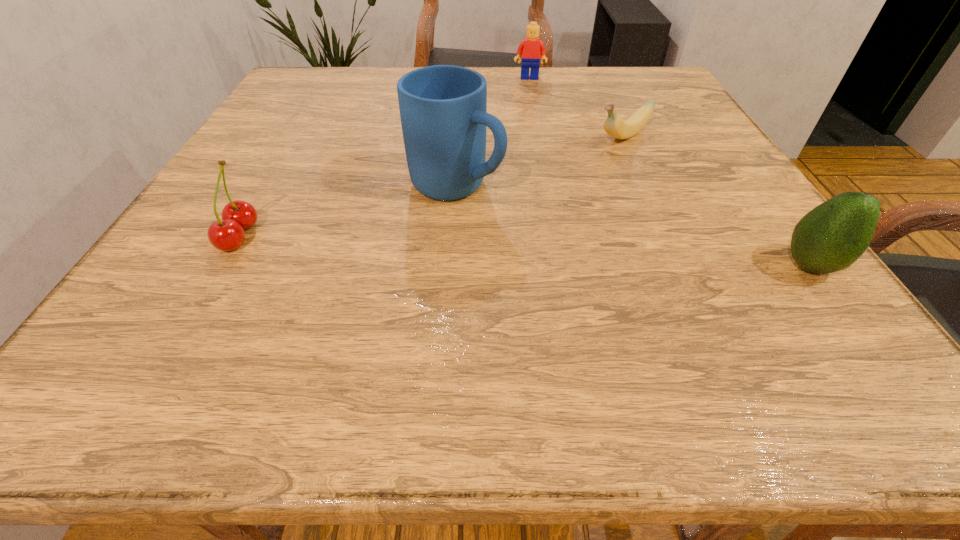
The height and width of the screenshot is (540, 960). I want to click on free space located 0.230m on the face of the farthest object, so click(x=531, y=123).

Locate an element on the screen. vacant space located 0.200m on the face of the farthest object is located at coordinates (531, 116).

Locate an element on the screen. This screenshot has width=960, height=540. vacant position located 0.200m on the face of the farthest object is located at coordinates (531, 116).

At what (x,y) coordinates should I click in order to perform the action: click on free point located on the side of the tallest object with the handle. Please return your answer as a coordinate pair (x, y). The height and width of the screenshot is (540, 960). Looking at the image, I should click on (540, 224).

The height and width of the screenshot is (540, 960). I want to click on free region located 0.400m on the side of the tallest object with the handle, so (x=723, y=313).

At what (x,y) coordinates should I click in order to perform the action: click on vacant space located on the side of the tallest object with the handle. Please return your answer as a coordinate pair (x, y). Image resolution: width=960 pixels, height=540 pixels. Looking at the image, I should click on (561, 234).

At what (x,y) coordinates should I click in order to perform the action: click on vacant space situated at the stem of the fourth object from left to right. Please return your answer as a coordinate pair (x, y). The image size is (960, 540). Looking at the image, I should click on (551, 184).

Find the location of a particular element. The image size is (960, 540). vacant area situated at the stem of the fourth object from left to right is located at coordinates (530, 197).

Find the location of a particular element. The height and width of the screenshot is (540, 960). blank space located 0.300m at the stem of the fourth object from left to right is located at coordinates (503, 214).

I want to click on object that is positioned at the far edge, so click(530, 49).